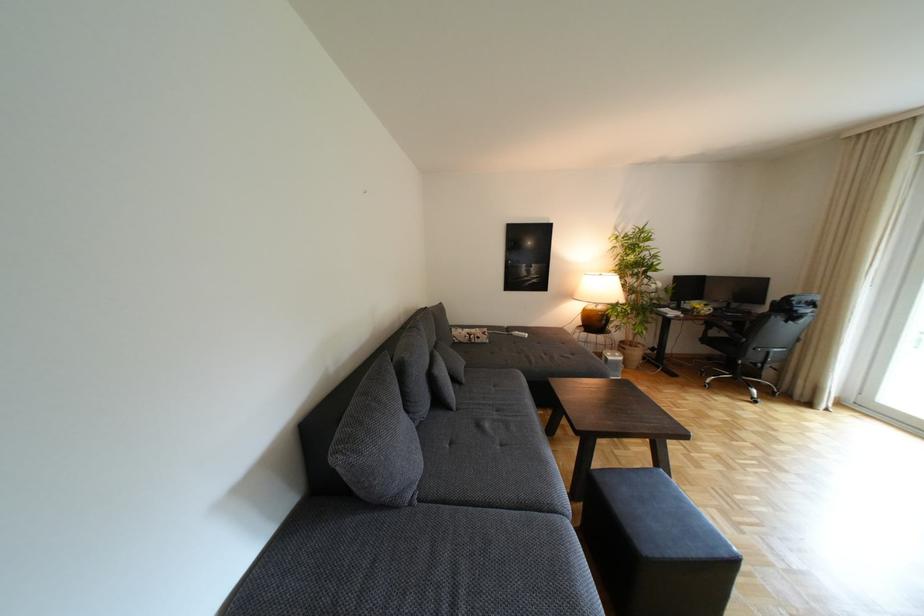
You are a GUI agent. You are given a task and a screenshot of the screen. Output one action in this format:
    pyautogui.click(x=<x>, y=<y>)
    Task: Click on the black chair armrest
    This screenshot has width=924, height=616.
    Given the screenshot: What is the action you would take?
    pyautogui.click(x=718, y=325)